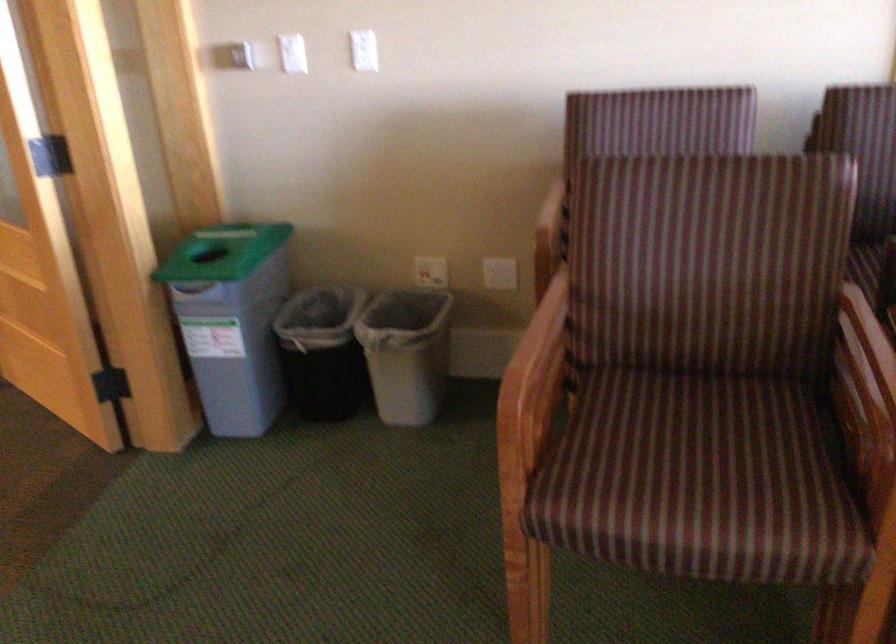
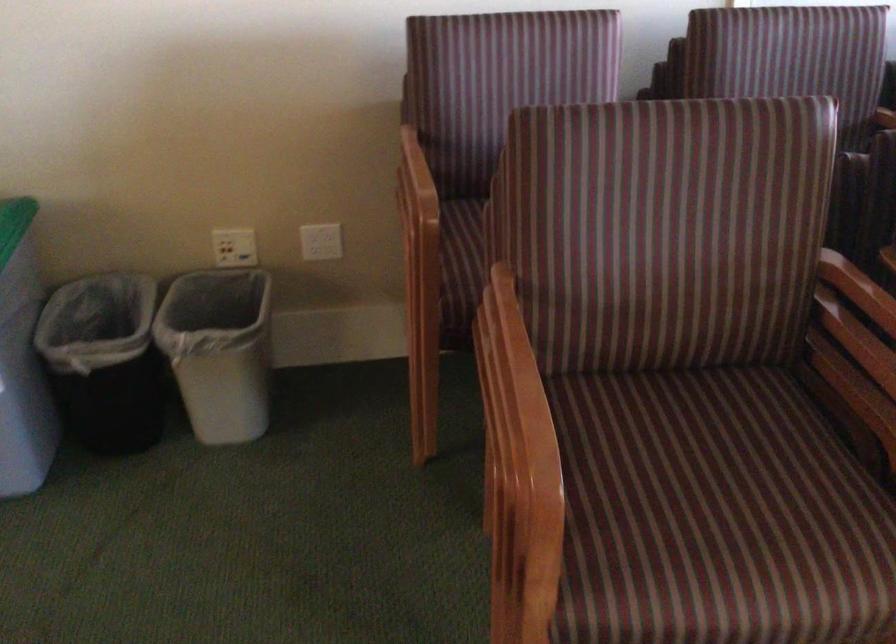
Question: The camera is either moving clockwise (left) or counter-clockwise (right) around the object. The first image is from the beginning of the video and the second image is from the end. Is the camera moving left or right when shooting the video?

Choices:
 (A) Left
 (B) Right

Answer: (A)